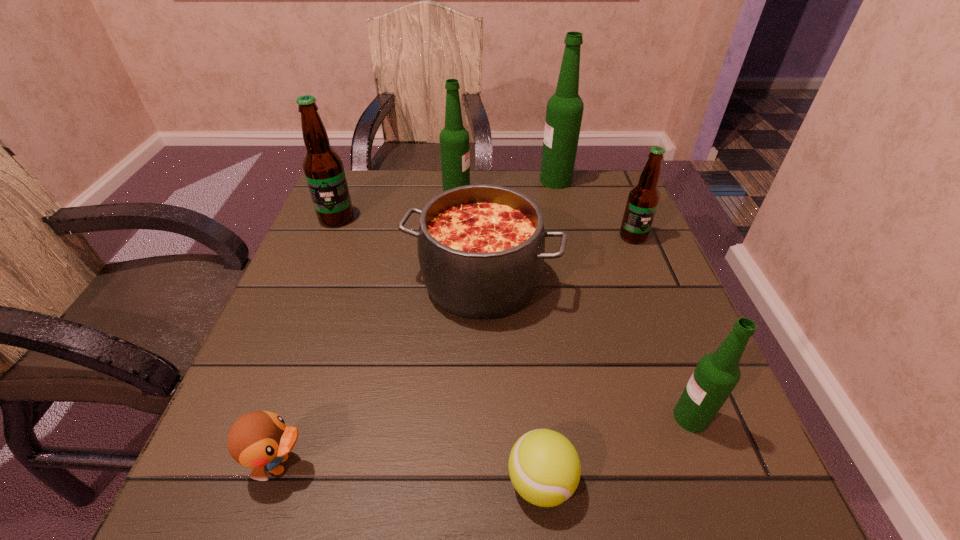
Find the location of a particular element. This screenshot has width=960, height=540. vacant area that lies between the second smallest green beer bottle and the smaller brown beer bottle is located at coordinates (545, 217).

The image size is (960, 540). I want to click on vacant point located between the seventh tallest object and the left brown beer bottle, so click(309, 341).

Locate an element on the screen. free space that is in between the right brown beer bottle and the smallest green beer bottle is located at coordinates (661, 327).

You are a GUI agent. You are given a task and a screenshot of the screen. Output one action in this format:
    pyautogui.click(x=<x>, y=<y>)
    Task: Click on the vacant area that lies between the left brown beer bottle and the nearest beer bottle
    The height and width of the screenshot is (540, 960).
    Given the screenshot: What is the action you would take?
    pyautogui.click(x=514, y=318)

Locate an element on the screen. free point between the green tennis ball and the nearest green beer bottle is located at coordinates (616, 450).

Where is `vacant region between the right brown beer bottle and the second beer bottle from left to right`? This screenshot has width=960, height=540. vacant region between the right brown beer bottle and the second beer bottle from left to right is located at coordinates 545,217.

The image size is (960, 540). I want to click on the sixth closest object to the biggest green beer bottle, so click(544, 467).

At what (x,y) coordinates should I click in order to perform the action: click on the second closest object to the tallest beer bottle. Please return your answer as a coordinate pair (x, y). The height and width of the screenshot is (540, 960). Looking at the image, I should click on (454, 140).

Locate an element on the screen. The height and width of the screenshot is (540, 960). beer bottle that stands as the third closest to the shortest object is located at coordinates 323,168.

Where is `beer bottle that is the third closest to the fourth beer bottle from right to left`? beer bottle that is the third closest to the fourth beer bottle from right to left is located at coordinates (643, 199).